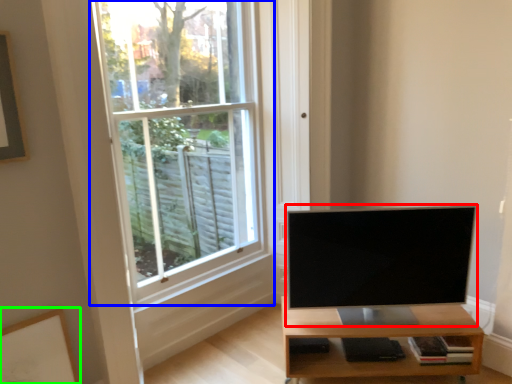
Question: Based on their relative distances, which object is nearer to television (highlighted by a red box)? Choose from window (highlighted by a blue box) and picture frame (highlighted by a green box).

Choices:
 (A) window
 (B) picture frame

Answer: (A)